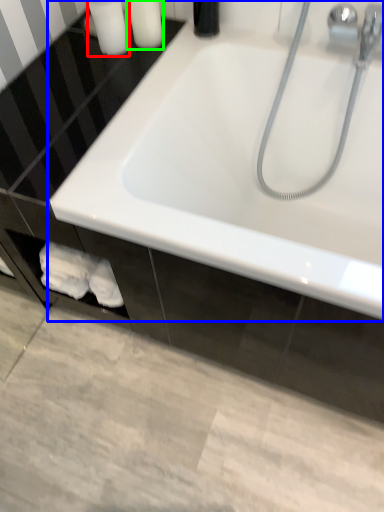
Question: Estimate the real-world distances between objects in this image. Which object is farther from toiletry (highlighted by a red box), bathtub (highlighted by a blue box) or toiletry (highlighted by a green box)?

Choices:
 (A) bathtub
 (B) toiletry

Answer: (A)